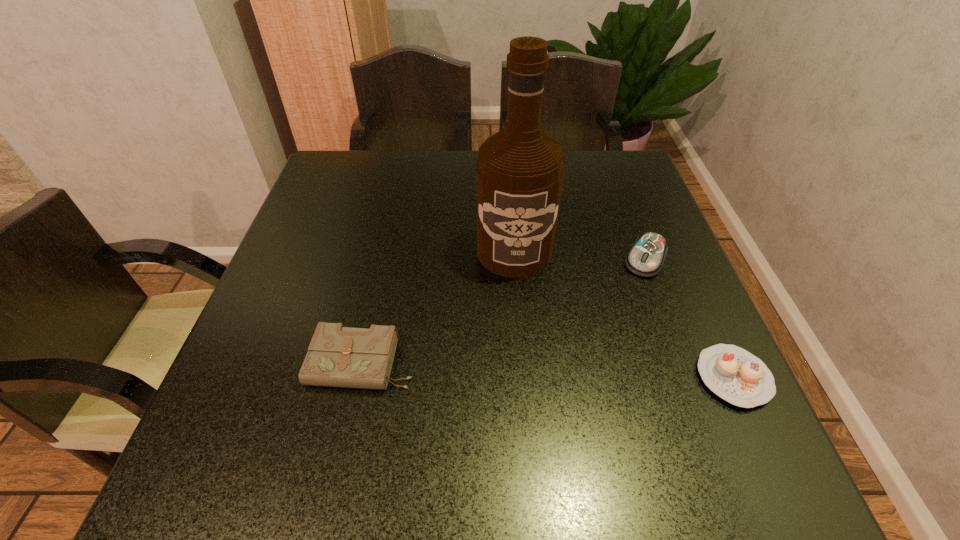
Find the location of a particular element. free space between the computer mouse and the leftmost object is located at coordinates (504, 311).

Identify the location of vacant point located between the leftmost object and the computer mouse. This screenshot has height=540, width=960. (504, 311).

The height and width of the screenshot is (540, 960). In order to click on object that ranks as the third closest to the cupcake in this screenshot , I will do tap(338, 356).

Identify which object is located as the nearest to the tallest object. Please provide its 2D coordinates. Your answer should be formatted as a tuple, i.e. [(x, y)], where the tuple contains the x and y coordinates of a point satisfying the conditions above.

[(646, 257)]

Where is `free space that satisfies the following two spatial constraints: 1. on the front side of the computer mouse; 2. on the right side of the tallest object`? Image resolution: width=960 pixels, height=540 pixels. free space that satisfies the following two spatial constraints: 1. on the front side of the computer mouse; 2. on the right side of the tallest object is located at coordinates (515, 260).

This screenshot has width=960, height=540. What are the coordinates of `vacant space that satisfies the following two spatial constraints: 1. on the front side of the computer mouse; 2. on the right side of the tallest object` in the screenshot? It's located at (515, 260).